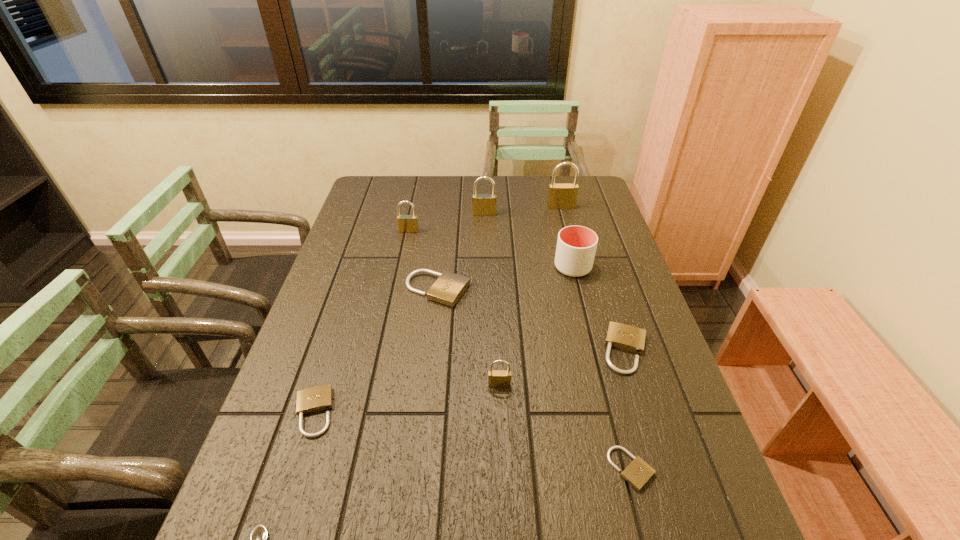
Identify the location of the sixth tallest object. (449, 287).

Locate an element on the screen. This screenshot has height=540, width=960. the second biggest beige padlock is located at coordinates (621, 336).

Locate an element on the screen. This screenshot has height=540, width=960. the sixth tallest padlock is located at coordinates (621, 336).

Where is `the second nearest beige padlock`? the second nearest beige padlock is located at coordinates (315, 399).

Where is `the seventh farthest padlock`? The height and width of the screenshot is (540, 960). the seventh farthest padlock is located at coordinates (315, 399).

Locate an element on the screen. Image resolution: width=960 pixels, height=540 pixels. the nearest padlock is located at coordinates (638, 473).

At what (x,y) coordinates should I click in order to perform the action: click on the second nearest object. Please return your answer as a coordinate pair (x, y). Looking at the image, I should click on (638, 473).

Image resolution: width=960 pixels, height=540 pixels. Find the location of `free space located on the front-facing side of the farthest padlock`. free space located on the front-facing side of the farthest padlock is located at coordinates (575, 261).

At what (x,y) coordinates should I click in order to perform the action: click on vacant space located 0.230m on the front-facing side of the second tallest object. Please return your answer as a coordinate pair (x, y). Looking at the image, I should click on (485, 255).

Identify the location of vacant space located 0.360m on the front-facing side of the third farthest padlock. This screenshot has height=540, width=960. [393, 308].